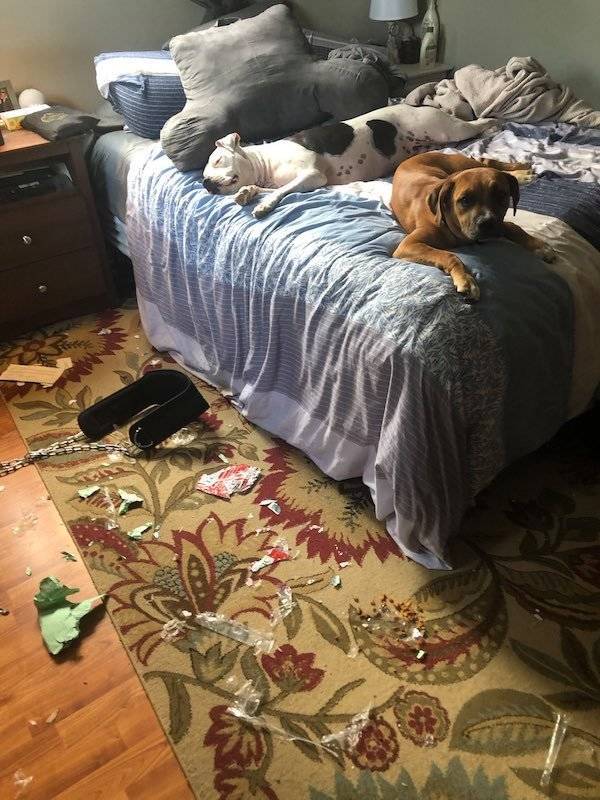
The image size is (600, 800). Find the location of `nightstand`. nightstand is located at coordinates (74, 226).